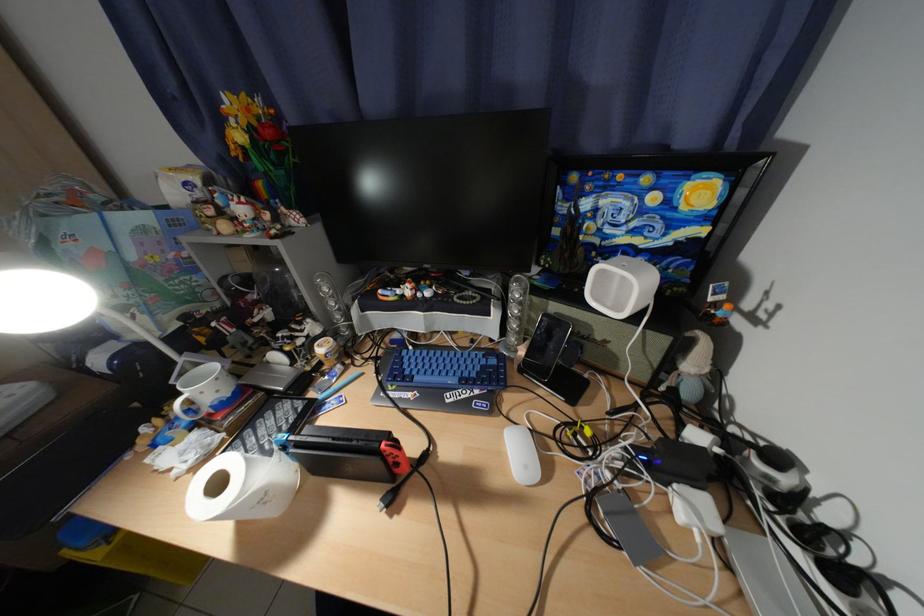
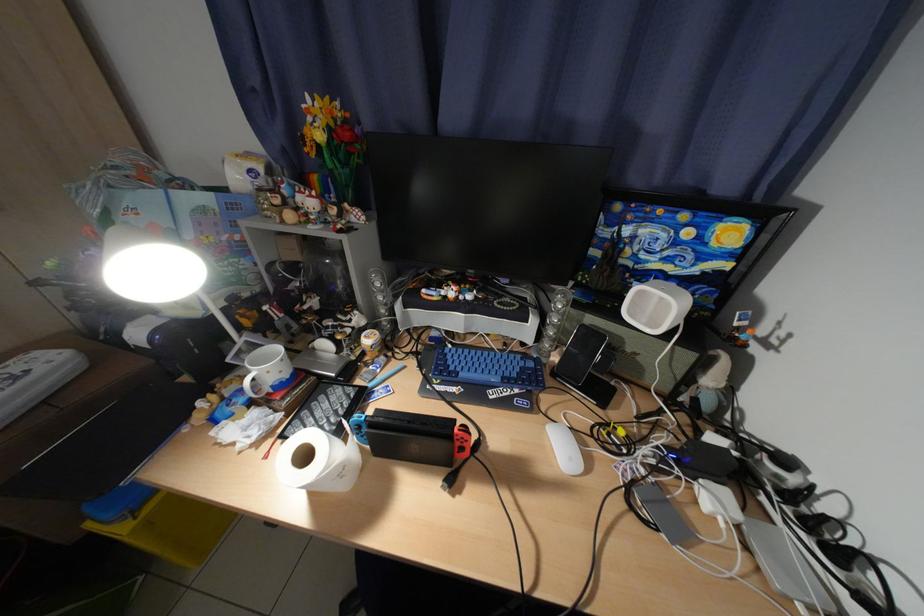
Locate, in the second image, the point that corresponds to the point at 323,395 in the first image.

(370, 383)